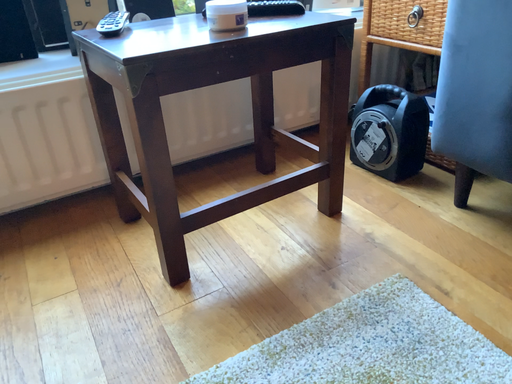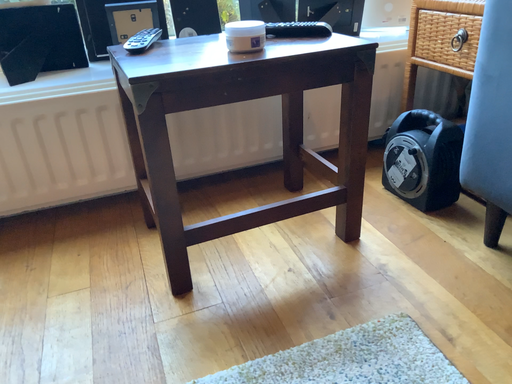
Question: How did the camera likely rotate when shooting the video?

Choices:
 (A) rotated right
 (B) rotated left

Answer: (B)